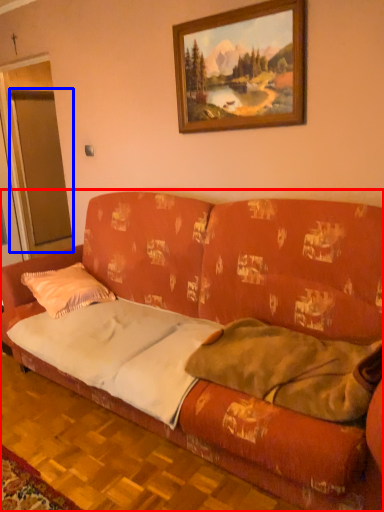
Question: Which object appears closest to the camera in this image, studio couch (highlighted by a red box) or glass door (highlighted by a blue box)?

Choices:
 (A) studio couch
 (B) glass door

Answer: (A)